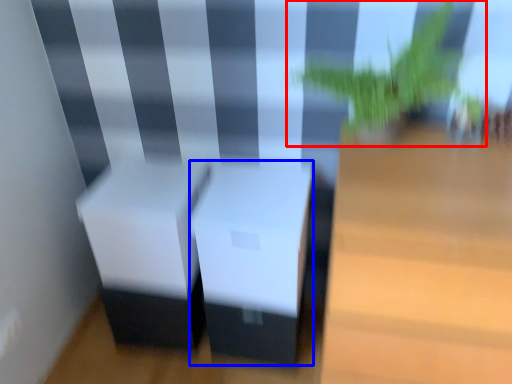
Question: Which of the following is the closest to the observer, houseplant (highlighted by a red box) or table (highlighted by a blue box)?

Choices:
 (A) houseplant
 (B) table

Answer: (A)